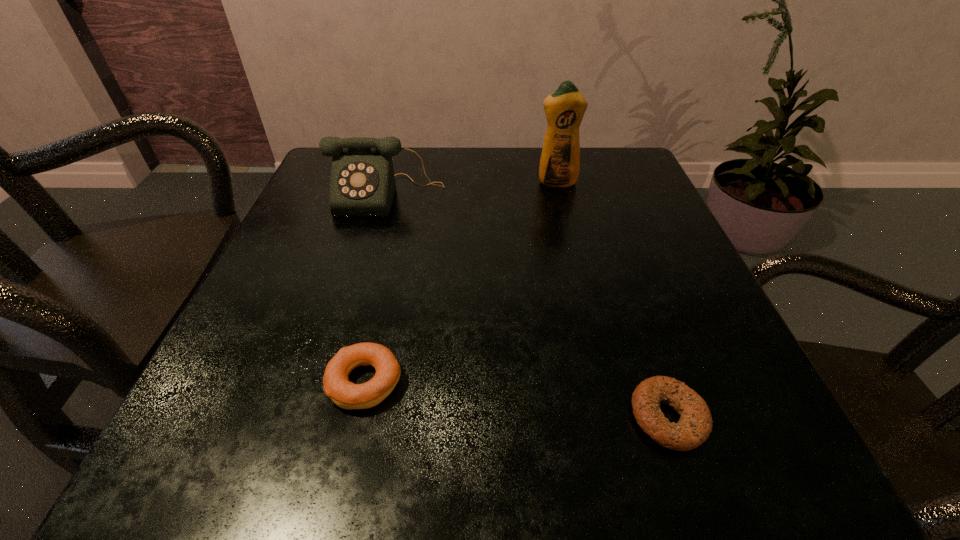
You are a GUI agent. You are given a task and a screenshot of the screen. Output one action in this format:
    pyautogui.click(x=<x>, y=<y>)
    Task: Click on the tallest object
    The height and width of the screenshot is (540, 960).
    Given the screenshot: What is the action you would take?
    pyautogui.click(x=560, y=160)

I want to click on the third shortest object, so click(x=362, y=183).

The width and height of the screenshot is (960, 540). In order to click on the left bagel in this screenshot , I will do `click(345, 394)`.

The height and width of the screenshot is (540, 960). I want to click on the right bagel, so click(x=695, y=424).

This screenshot has height=540, width=960. I want to click on vacant space located on the label of the detergent, so click(x=586, y=301).

This screenshot has height=540, width=960. I want to click on free spot located on the dial of the telephone, so click(x=334, y=381).

Where is `vacant area located 0.260m on the right of the left bagel`? vacant area located 0.260m on the right of the left bagel is located at coordinates 593,382.

The image size is (960, 540). Identify the location of vacant area situated on the left of the right bagel. (584, 417).

Locate an element on the screen. detergent that is at the far edge is located at coordinates (560, 160).

The width and height of the screenshot is (960, 540). Identify the location of telephone at the far edge. (362, 183).